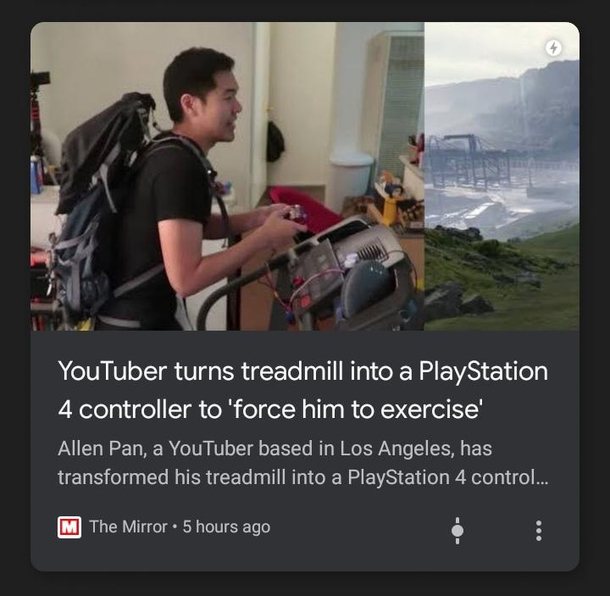
Where is `treadmill`? treadmill is located at coordinates (363, 249).